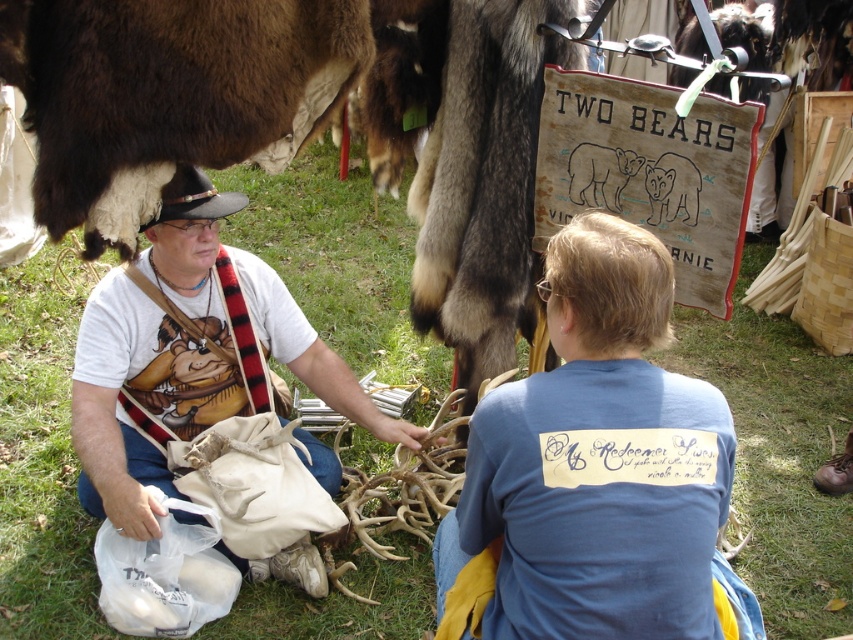
How far apart are green grass at center and white cotton t-shirt at center?

The distance of green grass at center from white cotton t-shirt at center is 1.26 meters.

Is point (55, 452) positioned in front of point (172, 284)?

No.

This screenshot has height=640, width=853. In order to click on green grass at center in this screenshot , I will do `click(779, 456)`.

Find the location of a particular element. The height and width of the screenshot is (640, 853). green grass at center is located at coordinates (779, 456).

Can you confirm if green grass at center is taller than black leather cowboy hat at upper left?

Yes.

Is point (735, 376) closer to camera compared to point (173, 173)?

That is False.

At what (x,y) coordinates should I click in order to perform the action: click on green grass at center. Please return your answer as a coordinate pair (x, y). Looking at the image, I should click on (779, 456).

Who is lower down, blue cotton shirt at center or black leather cowboy hat at upper left?

blue cotton shirt at center

This screenshot has width=853, height=640. Describe the element at coordinates (595, 467) in the screenshot. I see `blue cotton shirt at center` at that location.

Is point (675, 424) in front of point (196, 212)?

Yes, it is in front of point (196, 212).

Locate an element on the screen. blue cotton shirt at center is located at coordinates (595, 467).